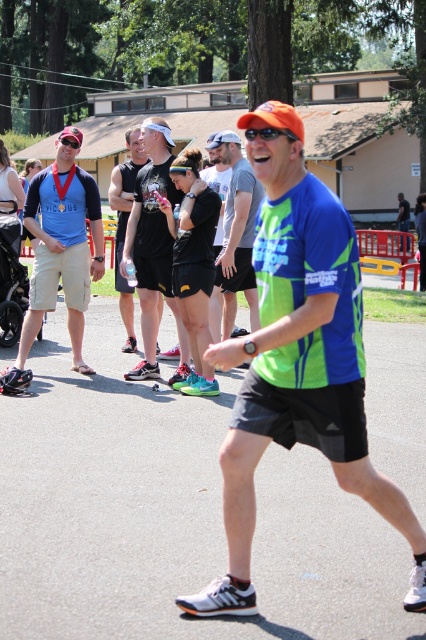
Does black matte shorts at center have a greater width compared to neon green jersey at center?

Correct, the width of black matte shorts at center exceeds that of neon green jersey at center.

Can you confirm if black matte shorts at center is taller than neon green jersey at center?

Correct, black matte shorts at center is much taller as neon green jersey at center.

This screenshot has height=640, width=426. I want to click on black matte shorts at center, so click(154, 248).

This screenshot has height=640, width=426. I want to click on black matte shorts at center, so click(x=154, y=248).

Looking at this image, does matte blue shirt at left have a greater height compared to black matte shorts at center?

No, matte blue shirt at left is not taller than black matte shorts at center.

Is point (66, 129) closer to camera compared to point (155, 266)?

Yes, it is.

The width and height of the screenshot is (426, 640). I want to click on matte blue shirt at left, so click(60, 252).

Between neon green/reflective fabric shirt at center and neon green jersey at center, which one has more height?

neon green/reflective fabric shirt at center

At what (x,y) coordinates should I click in order to perform the action: click on neon green/reflective fabric shirt at center. Please return your answer as a coordinate pair (x, y). The height and width of the screenshot is (640, 426). Looking at the image, I should click on (298, 356).

Who is more distant from viewer, (319, 371) or (241, 224)?

Positioned behind is point (241, 224).

Find the location of `neon green/reflective fabric shirt at center`. neon green/reflective fabric shirt at center is located at coordinates (298, 356).